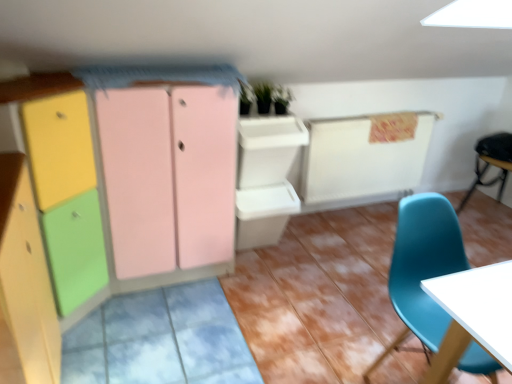
This screenshot has width=512, height=384. Find the location of `free spot in front of matte pink cabinet at center, which is the third cabinetry from front to back`. free spot in front of matte pink cabinet at center, which is the third cabinetry from front to back is located at coordinates (184, 330).